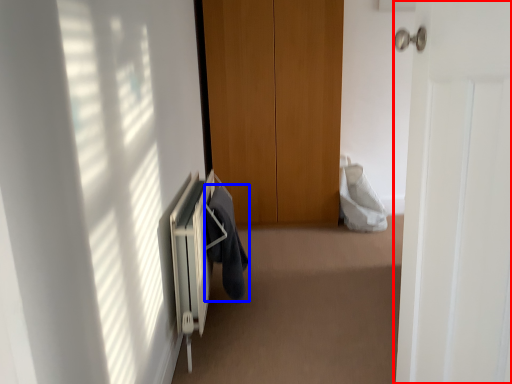
Question: Which of the following is the farthest to the observer, door (highlighted by a red box) or garment (highlighted by a blue box)?

Choices:
 (A) door
 (B) garment

Answer: (B)